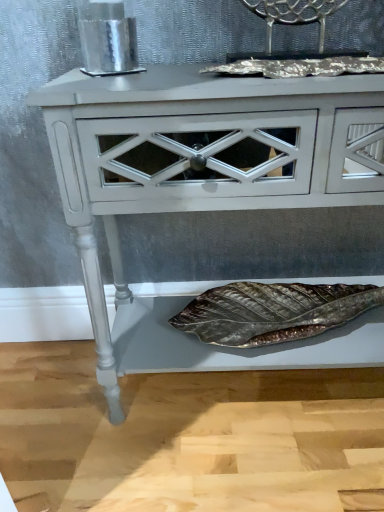
Describe the element at coordinates (207, 189) in the screenshot. I see `matte white wooden nightstand at center` at that location.

Locate an element on the screen. matte white wooden nightstand at center is located at coordinates (207, 189).

Where is `matte white wooden nightstand at center`? matte white wooden nightstand at center is located at coordinates (207, 189).